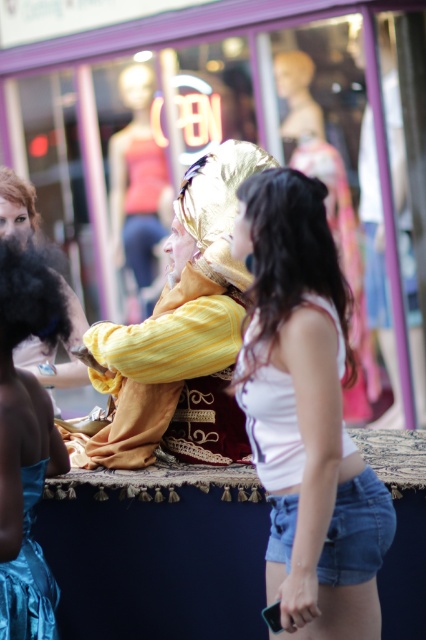
Which is more to the right, white denim shorts at center or blonde synthetic wig at upper left?

white denim shorts at center

Is point (351, 563) farther from camera compared to point (11, 200)?

No, (351, 563) is in front of (11, 200).

The width and height of the screenshot is (426, 640). I want to click on white denim shorts at center, so click(x=307, y=416).

Is white denim shorts at center in front of matte black wig at upper left?

Yes, white denim shorts at center is in front of matte black wig at upper left.

Can you confirm if white denim shorts at center is positioned below matte black wig at upper left?

Correct, white denim shorts at center is located below matte black wig at upper left.

Which is behind, point (308, 522) or point (63, 381)?

The point (63, 381) is behind.

You are a GUI agent. You are given a task and a screenshot of the screen. Output one action in this format:
    pyautogui.click(x=<x>, y=<y>)
    Task: Click on the white denim shorts at center
    The image size is (426, 640).
    Given the screenshot: What is the action you would take?
    pyautogui.click(x=307, y=416)

Does shiny gold wig at center have a larger size compared to shiny teal fabric dress at lower left?

Yes, shiny gold wig at center is bigger than shiny teal fabric dress at lower left.

Can you confirm if shiny gold wig at center is shorter than shiny teal fabric dress at lower left?

In fact, shiny gold wig at center may be taller than shiny teal fabric dress at lower left.

What do you see at coordinates (290, 257) in the screenshot? This screenshot has height=640, width=426. I see `shiny gold wig at center` at bounding box center [290, 257].

This screenshot has height=640, width=426. Identify the location of shiny gold wig at center. (290, 257).